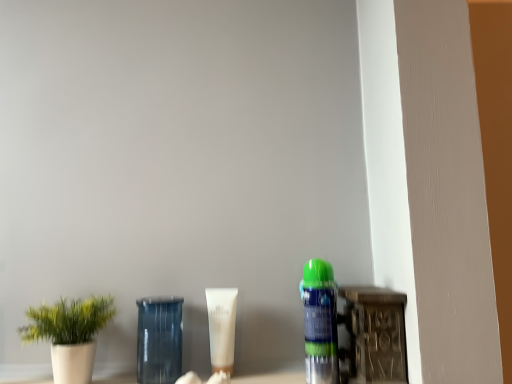
Question: Considering their positions, is white matte plant pot at left located in front of or behind white matte tube at center?

Choices:
 (A) front
 (B) behind

Answer: (A)

Question: Considering the positions of point (53, 334) and point (212, 309), is point (53, 334) closer or farther from the camera than point (212, 309)?

Choices:
 (A) closer
 (B) farther

Answer: (A)

Question: Estimate the real-world distances between objects in this image. Which object is farther from the white matte tube at center?

Choices:
 (A) green matte spray can at right
 (B) white matte plant pot at left
 (C) transparent glass jar at center

Answer: (B)

Question: Which object is the closest to the white matte plant pot at left?

Choices:
 (A) green matte spray can at right
 (B) transparent glass jar at center
 (C) white matte tube at center

Answer: (B)